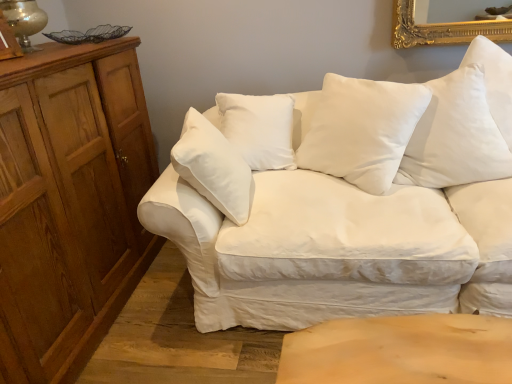
Identify the location of white cotton pillow at upper right, the 2th pillow when ordered from left to right. The height and width of the screenshot is (384, 512). (455, 136).

This screenshot has height=384, width=512. Describe the element at coordinates (455, 136) in the screenshot. I see `white cotton pillow at upper right, the 2th pillow when ordered from left to right` at that location.

In order to face white soft cushion at center, which is counted as the 2th pillow, starting from the right, should I rotate leftwards or rightwards?

A 13.225 degree turn to the right will do.

The height and width of the screenshot is (384, 512). I want to click on wooden dresser at left, so click(x=70, y=203).

I want to click on white cotton pillow at upper right, the 2th pillow when ordered from left to right, so click(455, 136).

Considering the sizes of objects white cotton couch at center and matte gold table lamp at upper left in the image provided, who is wider, white cotton couch at center or matte gold table lamp at upper left?

white cotton couch at center is wider.

Looking at this image, is the surface of white cotton couch at center in direct contact with matte gold table lamp at upper left?

No.

Does white cotton couch at center come behind matte gold table lamp at upper left?

No, it is in front of matte gold table lamp at upper left.

From a real-world perspective, which object stands above the other?

In real-world perspective, matte gold table lamp at upper left is above.

Looking at this image, considering the positions of objects matte gold table lamp at upper left and white cotton pillow at upper right, the 2th pillow when ordered from left to right, in the image provided, who is more to the right, matte gold table lamp at upper left or white cotton pillow at upper right, the 2th pillow when ordered from left to right,?

white cotton pillow at upper right, the 2th pillow when ordered from left to right.

Is matte gold table lamp at upper left in front of white cotton pillow at upper right, the 2th pillow when ordered from left to right?

That is False.

From a real-world perspective, is matte gold table lamp at upper left above or below white cotton pillow at upper right, marked as the first pillow in a right-to-left arrangement?

matte gold table lamp at upper left is situated higher than white cotton pillow at upper right, marked as the first pillow in a right-to-left arrangement, in the real world.

Is matte gold table lamp at upper left looking in the opposite direction of white cotton pillow at upper right, marked as the first pillow in a right-to-left arrangement?

No, white cotton pillow at upper right, marked as the first pillow in a right-to-left arrangement, is not at the back of matte gold table lamp at upper left.

From the image's perspective, is white cotton couch at center on white soft cushion at center, which is counted as the 2th pillow, starting from the right?

No, from the image's perspective, white cotton couch at center is not on top of white soft cushion at center, which is counted as the 2th pillow, starting from the right.

Which object is further away from the camera, white cotton couch at center or white soft cushion at center, which is counted as the 2th pillow, starting from the right?

white soft cushion at center, which is counted as the 2th pillow, starting from the right, is further from the camera.

From a real-world perspective, between white cotton couch at center and white soft cushion at center, arranged as the first pillow when viewed from the left, who is vertically lower?

white cotton couch at center.

From a real-world perspective, which object rests below the other?

In real-world perspective, wooden dresser at left is lower.

Is white soft cushion at center, which is counted as the 2th pillow, starting from the right, inside the boundaries of wooden dresser at left, or outside?

white soft cushion at center, which is counted as the 2th pillow, starting from the right, is located beyond the bounds of wooden dresser at left.

From the picture: Relative to wooden dresser at left, is white soft cushion at center, arranged as the first pillow when viewed from the left, in front or behind?

white soft cushion at center, arranged as the first pillow when viewed from the left, is behind wooden dresser at left.

Is white soft cushion at center, which is counted as the 2th pillow, starting from the right, shorter than wooden dresser at left?

Yes.

Considering the sizes of white cotton couch at center and white cotton pillow at upper right, marked as the first pillow in a right-to-left arrangement, in the image, is white cotton couch at center taller or shorter than white cotton pillow at upper right, marked as the first pillow in a right-to-left arrangement,?

In the image, white cotton couch at center appears to be taller than white cotton pillow at upper right, marked as the first pillow in a right-to-left arrangement.

Is white cotton couch at center inside the boundaries of white cotton pillow at upper right, the 2th pillow when ordered from left to right, or outside?

The correct answer is: outside.

Which is more to the left, white cotton couch at center or white cotton pillow at upper right, marked as the first pillow in a right-to-left arrangement?

white cotton couch at center.

From the image's perspective, between white cotton couch at center and white cotton pillow at upper right, marked as the first pillow in a right-to-left arrangement, which one is located above?

white cotton pillow at upper right, marked as the first pillow in a right-to-left arrangement, from the image's perspective.

Relative to wooden dresser at left, is matte gold table lamp at upper left in front or behind?

matte gold table lamp at upper left is behind wooden dresser at left.

In the scene shown: Is matte gold table lamp at upper left wider than wooden dresser at left?

No.

Can you confirm if matte gold table lamp at upper left is smaller than wooden dresser at left?

Yes.

Can you confirm if matte gold table lamp at upper left is positioned to the left of wooden dresser at left?

Yes.

Which of these two, wooden dresser at left or white cotton pillow at upper right, marked as the first pillow in a right-to-left arrangement, stands taller?

With more height is wooden dresser at left.

Can you confirm if wooden dresser at left is bigger than white cotton pillow at upper right, marked as the first pillow in a right-to-left arrangement?

Yes, wooden dresser at left is bigger than white cotton pillow at upper right, marked as the first pillow in a right-to-left arrangement.

Is the depth of wooden dresser at left greater than that of white cotton pillow at upper right, marked as the first pillow in a right-to-left arrangement?

No, wooden dresser at left is closer to the viewer.

Which object is thinner, wooden dresser at left or white cotton pillow at upper right, the 2th pillow when ordered from left to right?

With smaller width is white cotton pillow at upper right, the 2th pillow when ordered from left to right.

The height and width of the screenshot is (384, 512). There is a white cotton couch at center. Identify the location of table lamp above it (from a real-world perspective). (24, 20).

The height and width of the screenshot is (384, 512). In order to click on the 2nd pillow counting from the right of the matte gold table lamp at upper left in this screenshot , I will do `click(455, 136)`.

Which object lies nearer to the anchor point white cotton couch at center, white soft cushion at center, which is counted as the 2th pillow, starting from the right, or white cotton pillow at upper right, the 2th pillow when ordered from left to right?

white soft cushion at center, which is counted as the 2th pillow, starting from the right, lies closer to white cotton couch at center than the other object.

Which object lies nearer to the anchor point white cotton couch at center, white soft cushion at center, arranged as the first pillow when viewed from the left, or wooden dresser at left?

white soft cushion at center, arranged as the first pillow when viewed from the left, is closer to white cotton couch at center.

Estimate the real-world distances between objects in this image. Which object is closer to matte gold table lamp at upper left, wooden dresser at left or white cotton couch at center?

Based on the image, wooden dresser at left appears to be nearer to matte gold table lamp at upper left.

Looking at the image, which one is located closer to white soft cushion at center, arranged as the first pillow when viewed from the left, wooden dresser at left or matte gold table lamp at upper left?

Among the two, wooden dresser at left is located nearer to white soft cushion at center, arranged as the first pillow when viewed from the left.

Considering their positions, is white cotton couch at center positioned closer to matte gold table lamp at upper left than white cotton pillow at upper right, the 2th pillow when ordered from left to right?

The object closer to matte gold table lamp at upper left is white cotton couch at center.

Which object lies nearer to the anchor point wooden dresser at left, white cotton pillow at upper right, marked as the first pillow in a right-to-left arrangement, or matte gold table lamp at upper left?

matte gold table lamp at upper left is positioned closer to the anchor wooden dresser at left.

Considering their positions, is white cotton couch at center positioned closer to white soft cushion at center, which is counted as the 2th pillow, starting from the right, than matte gold table lamp at upper left?

Among the two, white cotton couch at center is located nearer to white soft cushion at center, which is counted as the 2th pillow, starting from the right.

Which object lies further to the anchor point white cotton couch at center, wooden dresser at left or matte gold table lamp at upper left?

The object further to white cotton couch at center is matte gold table lamp at upper left.

Locate an element on the screen. The width and height of the screenshot is (512, 384). dresser between matte gold table lamp at upper left and white cotton pillow at upper right, the 2th pillow when ordered from left to right, from left to right is located at coordinates click(x=70, y=203).

What are the coordinates of `pillow between matte gold table lamp at upper left and white cotton pillow at upper right, marked as the first pillow in a right-to-left arrangement, in the horizontal direction` in the screenshot? It's located at (360, 129).

Where is `dresser between matte gold table lamp at upper left and white cotton couch at center from left to right`? The height and width of the screenshot is (384, 512). dresser between matte gold table lamp at upper left and white cotton couch at center from left to right is located at coordinates (70, 203).

Where is `studio couch located between matte gold table lamp at upper left and white cotton pillow at upper right, the 2th pillow when ordered from left to right, in the left-right direction`? studio couch located between matte gold table lamp at upper left and white cotton pillow at upper right, the 2th pillow when ordered from left to right, in the left-right direction is located at coordinates (361, 206).